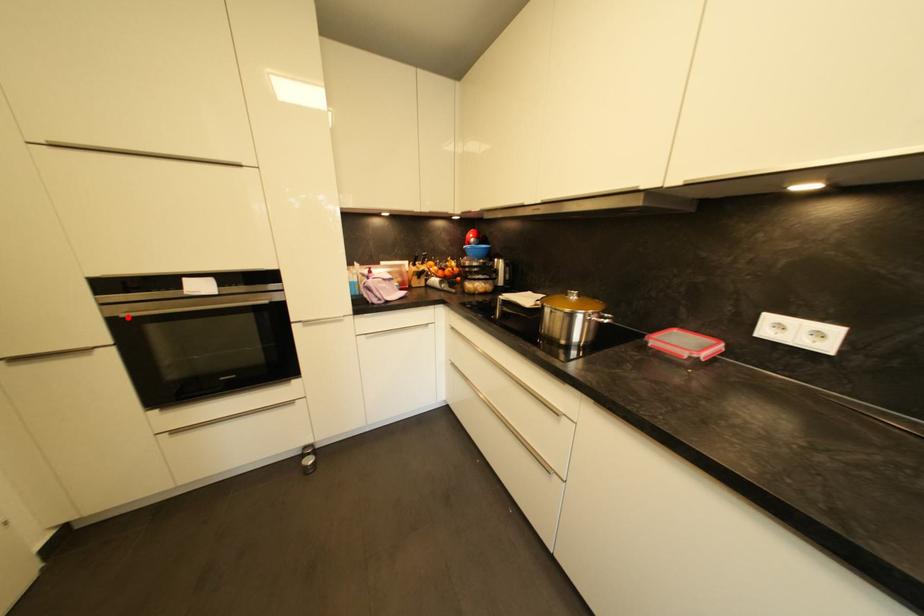
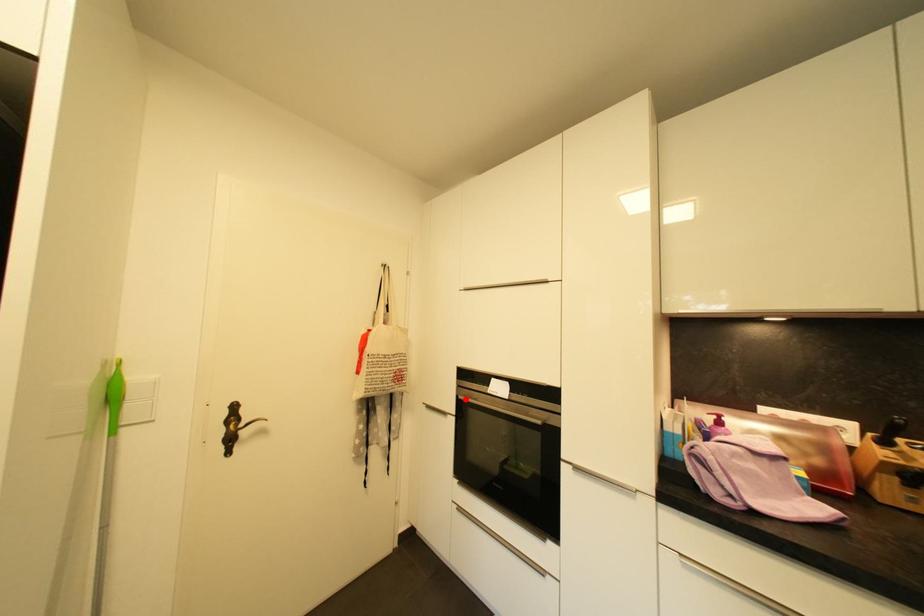
I am providing you with two images of the same scene from different viewpoints. A red point is marked on the first image and another point is marked on the second image. Is the marked point in image1 the same physical position as the marked point in image2?

Yes